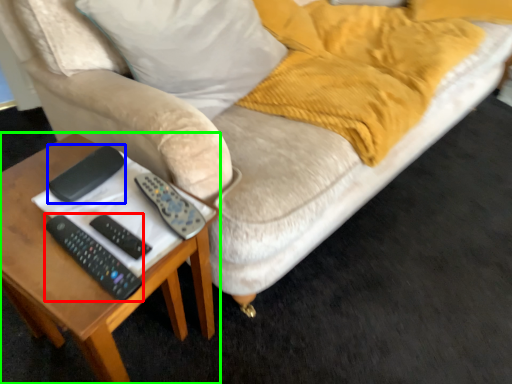
Question: Which object is the farthest from remote (highlighted by a red box)? Choose among these: gadget (highlighted by a blue box) or table (highlighted by a green box).

Choices:
 (A) gadget
 (B) table

Answer: (B)